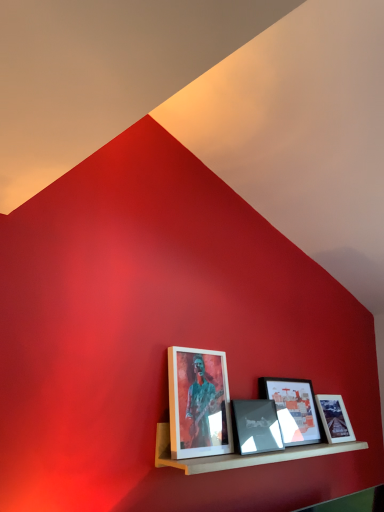
Question: Is matte black picture frame at center, the second picture frame from the right, shorter than matte black picture frame at center, the 2th picture frame viewed from the left?

Choices:
 (A) no
 (B) yes

Answer: (A)

Question: Is matte black picture frame at center, the second picture frame from the right, taller than matte black picture frame at center, the third picture frame in the right-to-left sequence?

Choices:
 (A) yes
 (B) no

Answer: (A)

Question: Is matte black picture frame at center, which is counted as the 3th picture frame, starting from the left, outside matte black picture frame at center, the third picture frame in the right-to-left sequence?

Choices:
 (A) no
 (B) yes

Answer: (B)

Question: Does matte black picture frame at center, the second picture frame from the right, lie behind matte black picture frame at center, the third picture frame in the right-to-left sequence?

Choices:
 (A) yes
 (B) no

Answer: (A)

Question: Is matte black picture frame at center, which is counted as the 3th picture frame, starting from the left, closer to camera compared to matte black picture frame at center, the third picture frame in the right-to-left sequence?

Choices:
 (A) no
 (B) yes

Answer: (A)

Question: In terms of height, does matte glass picture frame at center, placed as the fourth picture frame when sorted from left to right, look taller or shorter compared to wooden shelf at lower center?

Choices:
 (A) tall
 (B) short

Answer: (A)

Question: From a real-world perspective, is matte glass picture frame at center, placed as the fourth picture frame when sorted from left to right, above or below wooden shelf at lower center?

Choices:
 (A) below
 (B) above

Answer: (B)

Question: Would you say matte glass picture frame at center, which is the first picture frame from right to left, is inside or outside wooden shelf at lower center?

Choices:
 (A) outside
 (B) inside

Answer: (B)

Question: In the image, is matte glass picture frame at center, which is the first picture frame from right to left, positioned in front of or behind wooden shelf at lower center?

Choices:
 (A) behind
 (B) front

Answer: (A)

Question: From the image's perspective, is matte black picture frame at center, which is counted as the 3th picture frame, starting from the left, positioned above or below matte glass picture frame at center, which is the first picture frame from right to left?

Choices:
 (A) below
 (B) above

Answer: (B)

Question: Considering the positions of matte black picture frame at center, which is counted as the 3th picture frame, starting from the left, and matte glass picture frame at center, which is the first picture frame from right to left, in the image, is matte black picture frame at center, which is counted as the 3th picture frame, starting from the left, taller or shorter than matte glass picture frame at center, which is the first picture frame from right to left,?

Choices:
 (A) tall
 (B) short

Answer: (A)

Question: Looking at the image, does matte black picture frame at center, which is counted as the 3th picture frame, starting from the left, seem bigger or smaller compared to matte glass picture frame at center, placed as the fourth picture frame when sorted from left to right?

Choices:
 (A) big
 (B) small

Answer: (A)

Question: Would you say matte black picture frame at center, the second picture frame from the right, is to the left or to the right of matte glass picture frame at center, which is the first picture frame from right to left, in the picture?

Choices:
 (A) right
 (B) left

Answer: (B)

Question: In the image, is matte black picture frame at center, the second picture frame from the right, positioned in front of or behind matte black picture frame at center, the 2th picture frame viewed from the left?

Choices:
 (A) front
 (B) behind

Answer: (B)

Question: In terms of height, does matte black picture frame at center, which is counted as the 3th picture frame, starting from the left, look taller or shorter compared to matte black picture frame at center, the third picture frame in the right-to-left sequence?

Choices:
 (A) tall
 (B) short

Answer: (A)